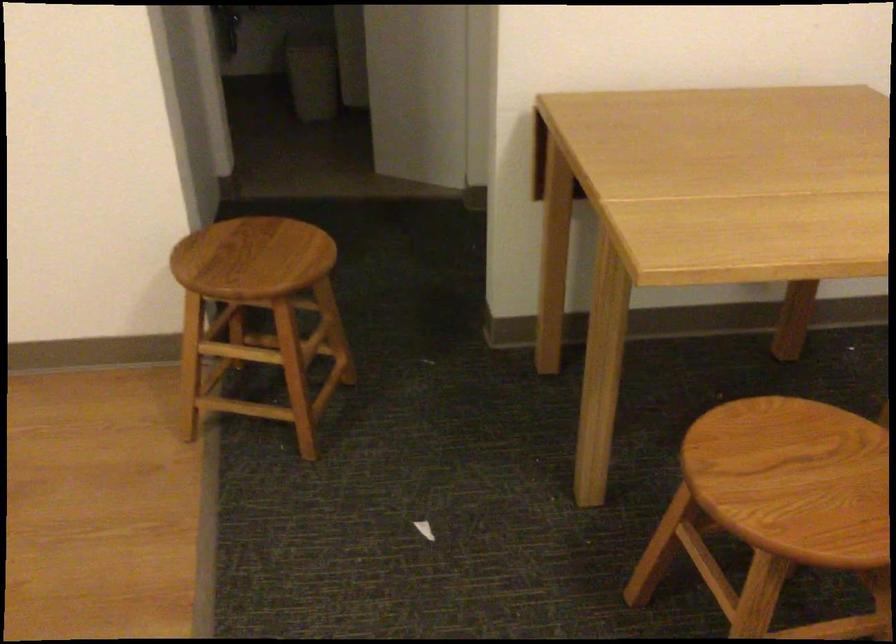
Identify the location of small paper scrap. This screenshot has width=896, height=644. (424, 529).